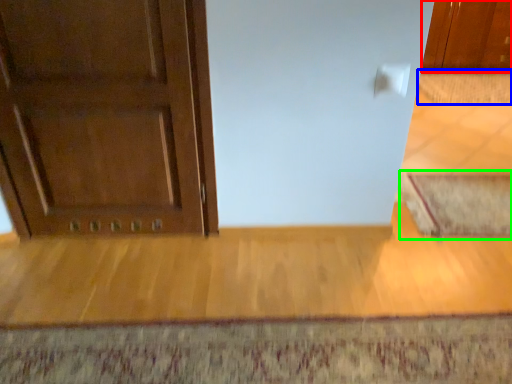
Question: Based on their relative distances, which object is nearer to cabinetry (highlighted by a red box)? Choose from doormat (highlighted by a blue box) and doormat (highlighted by a green box).

Choices:
 (A) doormat
 (B) doormat

Answer: (A)